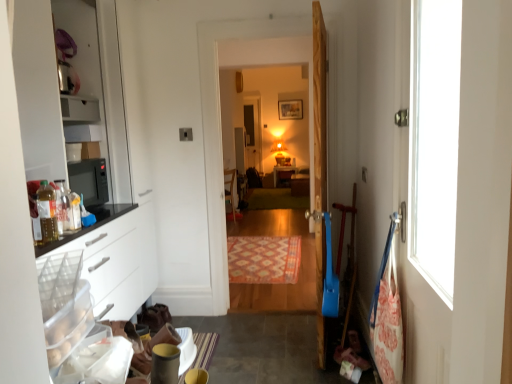
Question: From the image's perspective, is translucent plastic bottle at left under matte yellow concrete at lower left?

Choices:
 (A) yes
 (B) no

Answer: (B)

Question: Is translucent plastic bottle at left far from matte yellow concrete at lower left?

Choices:
 (A) no
 (B) yes

Answer: (B)

Question: Considering the relative positions of translucent plastic bottle at left and matte yellow concrete at lower left in the image provided, is translucent plastic bottle at left to the right of matte yellow concrete at lower left from the viewer's perspective?

Choices:
 (A) no
 (B) yes

Answer: (A)

Question: Does translucent plastic bottle at left have a greater height compared to matte yellow concrete at lower left?

Choices:
 (A) no
 (B) yes

Answer: (B)

Question: Considering the relative sizes of translucent plastic bottle at left and matte yellow concrete at lower left in the image provided, is translucent plastic bottle at left wider than matte yellow concrete at lower left?

Choices:
 (A) no
 (B) yes

Answer: (A)

Question: Is patterned carpet at center, which appears as the 2th mat when viewed from the top, in front of or behind wooden table at center in the image?

Choices:
 (A) behind
 (B) front

Answer: (B)

Question: From the image's perspective, is patterned carpet at center, the 1th mat in the front-to-back sequence, above or below wooden table at center?

Choices:
 (A) below
 (B) above

Answer: (A)

Question: From a real-world perspective, is patterned carpet at center, which is the 1th mat from bottom to top, positioned above or below wooden table at center?

Choices:
 (A) above
 (B) below

Answer: (B)

Question: Is patterned carpet at center, the 2th mat in the back-to-front sequence, inside or outside of wooden table at center?

Choices:
 (A) inside
 (B) outside

Answer: (B)

Question: In the image, is matte white cabinet at center positioned in front of or behind translucent plastic bottle at left?

Choices:
 (A) behind
 (B) front

Answer: (A)

Question: Considering the relative positions of matte white cabinet at center and translucent plastic bottle at left in the image provided, is matte white cabinet at center to the left or to the right of translucent plastic bottle at left?

Choices:
 (A) left
 (B) right

Answer: (B)

Question: From a real-world perspective, is matte white cabinet at center positioned above or below translucent plastic bottle at left?

Choices:
 (A) below
 (B) above

Answer: (A)

Question: Is matte white cabinet at center taller or shorter than translucent plastic bottle at left?

Choices:
 (A) short
 (B) tall

Answer: (B)

Question: Considering the positions of wooden door at center and matte white cabinet at center in the image, is wooden door at center bigger or smaller than matte white cabinet at center?

Choices:
 (A) big
 (B) small

Answer: (A)

Question: Considering the positions of wooden door at center and matte white cabinet at center in the image, is wooden door at center taller or shorter than matte white cabinet at center?

Choices:
 (A) short
 (B) tall

Answer: (B)